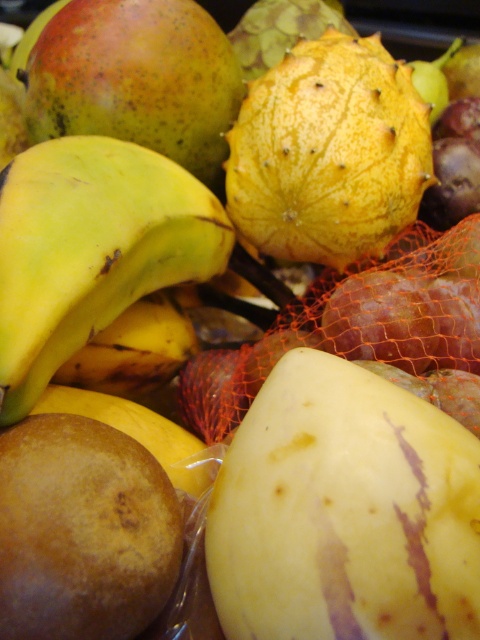
You are a fruit vendor arranging fruits on a shelf. You need to place a new fruit exactly at the center of the shelf. The shelf has a coordinate system where the bottom left corner is the origin. The yellow spiky fruit at center is already placed at point (328, 152). Can you confirm if this placement is correct?

Yes, the placement is correct because the point (328, 152) indicates that the yellow spiky fruit at center is already positioned at the center of the shelf.

You are arranging fruits on a shelf and need to place the yellow spiky fruit at center and the brown matte potato at lower left. Based on their positions in the image, which fruit is positioned higher on the shelf?

The yellow spiky fruit at center is located above the brown matte potato at lower left, so it is positioned higher on the shelf.

In the scene shown: You are a customer at a fruit stand and want to grab the yellow matte banana at left and the brown matte potato at lower left. Which one can you reach first without moving your hand?

The yellow matte banana at left is closer to you than the brown matte potato at lower left, so you can reach the yellow matte banana at left first without moving your hand.